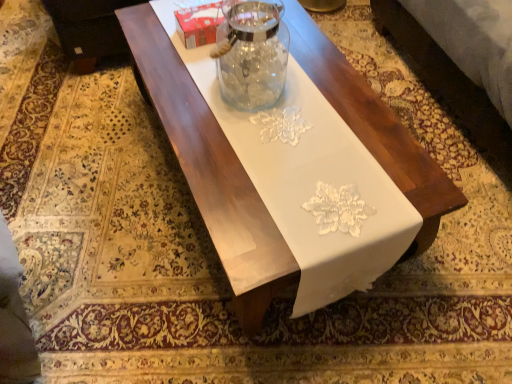
Question: Is black leather couch at upper left facing towards white glossy table at center?

Choices:
 (A) yes
 (B) no

Answer: (B)

Question: Considering the relative sizes of black leather couch at upper left and white glossy table at center in the image provided, is black leather couch at upper left bigger than white glossy table at center?

Choices:
 (A) no
 (B) yes

Answer: (A)

Question: Does black leather couch at upper left have a greater height compared to white glossy table at center?

Choices:
 (A) yes
 (B) no

Answer: (B)

Question: Is there a large distance between black leather couch at upper left and white glossy table at center?

Choices:
 (A) no
 (B) yes

Answer: (A)

Question: Considering the relative positions of black leather couch at upper left and white glossy table at center in the image provided, is black leather couch at upper left to the left of white glossy table at center from the viewer's perspective?

Choices:
 (A) no
 (B) yes

Answer: (B)

Question: From a real-world perspective, is white glossy table at center physically located above or below black leather couch at upper left?

Choices:
 (A) below
 (B) above

Answer: (A)

Question: Is white glossy table at center inside the boundaries of black leather couch at upper left, or outside?

Choices:
 (A) outside
 (B) inside

Answer: (A)

Question: In the image, is white glossy table at center on the left side or the right side of black leather couch at upper left?

Choices:
 (A) right
 (B) left

Answer: (A)

Question: In terms of height, does white glossy table at center look taller or shorter compared to black leather couch at upper left?

Choices:
 (A) tall
 (B) short

Answer: (A)

Question: From a real-world perspective, is transparent glass jar at center positioned above or below white glossy table at center?

Choices:
 (A) above
 (B) below

Answer: (A)

Question: From their relative heights in the image, would you say transparent glass jar at center is taller or shorter than white glossy table at center?

Choices:
 (A) tall
 (B) short

Answer: (B)

Question: In the image, is transparent glass jar at center positioned in front of or behind white glossy table at center?

Choices:
 (A) front
 (B) behind

Answer: (B)

Question: Is transparent glass jar at center wider or thinner than white glossy table at center?

Choices:
 (A) thin
 (B) wide

Answer: (A)

Question: Looking at the image, does white glossy table at center seem bigger or smaller compared to transparent glass jar at center?

Choices:
 (A) big
 (B) small

Answer: (A)

Question: Would you say white glossy table at center is to the left or to the right of transparent glass jar at center in the picture?

Choices:
 (A) left
 (B) right

Answer: (B)